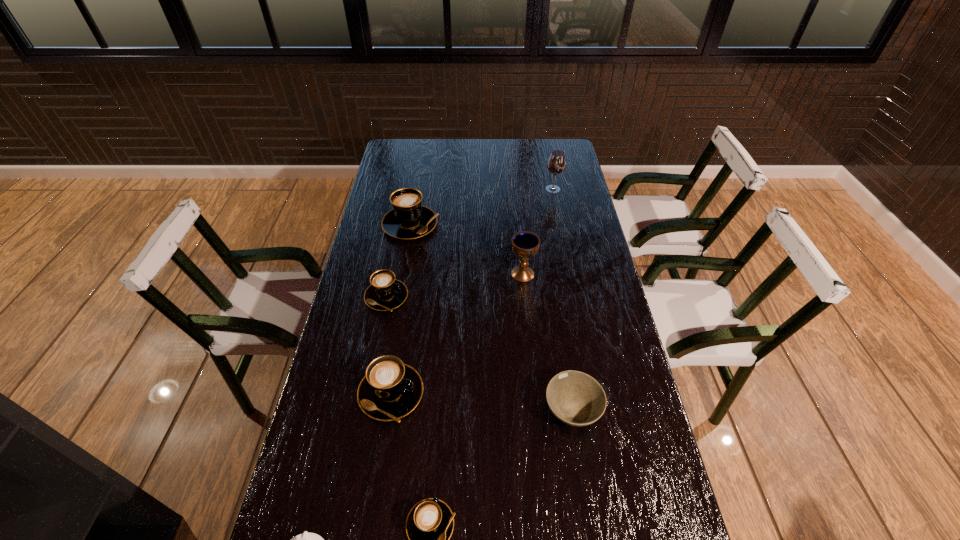
This screenshot has height=540, width=960. Identify the location of free region at the far left corner of the desktop. pyautogui.click(x=421, y=148).

Find the location of `vacant area between the second farthest cappuccino and the wineglass`. vacant area between the second farthest cappuccino and the wineglass is located at coordinates click(469, 243).

You are a GUI agent. You are given a task and a screenshot of the screen. Output one action in this format:
    pyautogui.click(x=<x>, y=<y>)
    Task: Click on the free space between the wineglass and the bowl
    Image resolution: width=960 pixels, height=540 pixels.
    Given the screenshot: What is the action you would take?
    pyautogui.click(x=563, y=300)

The image size is (960, 540). I want to click on blank region between the second smallest black cappuccino and the bowl, so click(479, 354).

Point out which object is positioned as the fourth nearest to the shortest cappuccino. Please provide its 2D coordinates. Your answer should be formatted as a tuple, i.e. [(x, y)], where the tuple contains the x and y coordinates of a point satisfying the conditions above.

[(385, 293)]

Identify the location of object that is the seventh closest one to the third farthest cappuccino. (556, 163).

Locate which cappuccino is the second closest to the chalice. Please provide its 2D coordinates. Your answer should be formatted as a tuple, i.e. [(x, y)], where the tuple contains the x and y coordinates of a point satisfying the conditions above.

[(385, 293)]

Locate an element on the screen. The image size is (960, 540). cappuccino that is the fourth nearest to the seventh tallest object is located at coordinates point(408,219).

In order to click on the second closest black cappuccino to the chalice in this screenshot , I will do `click(385, 293)`.

Identify which black cappuccino is located as the third nearest to the shortest cappuccino. Please provide its 2D coordinates. Your answer should be formatted as a tuple, i.e. [(x, y)], where the tuple contains the x and y coordinates of a point satisfying the conditions above.

[(385, 293)]